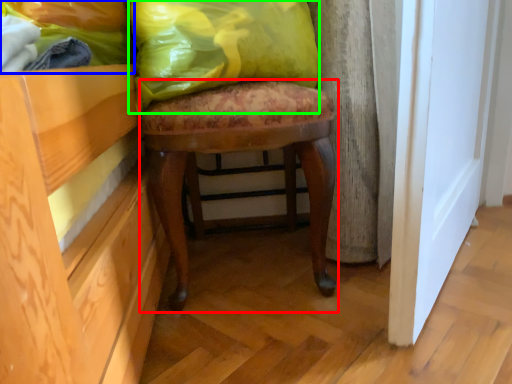
Question: Which is nearer to the stool (highlighted by a red box)? fabric (highlighted by a blue box) or throw pillow (highlighted by a green box).

Choices:
 (A) fabric
 (B) throw pillow

Answer: (B)